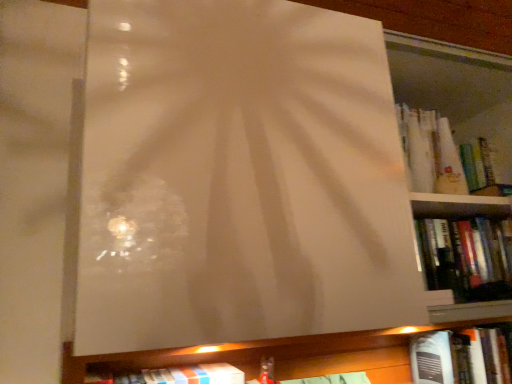
This screenshot has height=384, width=512. What do you see at coordinates (445, 157) in the screenshot? I see `hardcover book at upper right, marked as the 1th book in a top-to-bottom arrangement` at bounding box center [445, 157].

Find the location of a particular element. Image resolution: width=512 pixels, height=384 pixels. hardcover book at upper right, acting as the 3th book starting from the left is located at coordinates (445, 157).

From a real-world perspective, which object stands above the other?

In real-world perspective, hardcover book at upper right, which is the 3th book in bottom-to-top order, is above.

From the image's perspective, between hardcover book at lower right, which is the fourth book in left-to-right order, and hardcover book at upper right, the 2th book in the left-to-right sequence, who is located below?

hardcover book at lower right, which is the fourth book in left-to-right order, appears lower in the image.

Is there a large distance between hardcover book at lower right, acting as the 1th book starting from the right, and white matte book at lower center, the 3th book from the top?

No, hardcover book at lower right, acting as the 1th book starting from the right, is not far away from white matte book at lower center, the 3th book from the top.

Between hardcover book at lower right, acting as the fourth book starting from the top, and white matte book at lower center, positioned as the 1th book in left-to-right order, which one is positioned behind?

hardcover book at lower right, acting as the fourth book starting from the top.

From the image's perspective, is hardcover book at lower right, which is the fourth book in left-to-right order, located beneath white matte book at lower center, the 3th book from the top?

Correct, hardcover book at lower right, which is the fourth book in left-to-right order, appears lower than white matte book at lower center, the 3th book from the top, in the image.

Is hardcover book at upper right, the 2th book in the left-to-right sequence, further to the viewer compared to white matte book at lower center, placed as the 4th book when sorted from right to left?

Yes, it is.

Is hardcover book at upper right, the 3th book viewed from the right, oriented towards white matte book at lower center, the 2th book positioned from the bottom?

No.

Can you confirm if hardcover book at upper right, the 3th book viewed from the right, is taller than white matte book at lower center, positioned as the 1th book in left-to-right order?

Correct, hardcover book at upper right, the 3th book viewed from the right, is much taller as white matte book at lower center, positioned as the 1th book in left-to-right order.

From the image's perspective, which is above, hardcover book at upper right, the 2th book in the left-to-right sequence, or white matte book at lower center, placed as the 4th book when sorted from right to left?

From the image's view, hardcover book at upper right, the 2th book in the left-to-right sequence, is above.

From a real-world perspective, relative to white matte book at lower center, positioned as the 1th book in left-to-right order, is hardcover book at upper right, which ranks as the second book in right-to-left order, vertically above or below?

hardcover book at upper right, which ranks as the second book in right-to-left order, is above white matte book at lower center, positioned as the 1th book in left-to-right order.

From the image's perspective, which one is positioned higher, hardcover book at upper right, marked as the 1th book in a top-to-bottom arrangement, or white matte book at lower center, positioned as the 1th book in left-to-right order?

hardcover book at upper right, marked as the 1th book in a top-to-bottom arrangement, is shown above in the image.

Between hardcover book at upper right, acting as the 3th book starting from the left, and white matte book at lower center, the 3th book from the top, which one appears on the right side from the viewer's perspective?

Positioned to the right is hardcover book at upper right, acting as the 3th book starting from the left.

Does hardcover book at upper right, which ranks as the second book in right-to-left order, have a larger size compared to white matte book at lower center, placed as the 4th book when sorted from right to left?

Incorrect, hardcover book at upper right, which ranks as the second book in right-to-left order, is not larger than white matte book at lower center, placed as the 4th book when sorted from right to left.

From the hardcover book at upper right, the 2th book in the left-to-right sequence, count 2nd books backward and point to it. Please provide its 2D coordinates.

[(460, 358)]

Does hardcover book at upper right, the 2th book in the left-to-right sequence, appear on the left side of hardcover book at lower right, acting as the fourth book starting from the top?

Yes.

Is there a large distance between hardcover book at upper right, the 2th book in the left-to-right sequence, and hardcover book at lower right, acting as the fourth book starting from the top?

They are positioned close to each other.

Is hardcover book at upper right, acting as the 3th book starting from the left, inside or outside of hardcover book at upper right, the 2th book in the left-to-right sequence?

hardcover book at upper right, acting as the 3th book starting from the left, cannot be found inside hardcover book at upper right, the 2th book in the left-to-right sequence.

Identify the location of book above the hardcover book at upper right, which appears as the second book when viewed from the top (from a real-world perspective). This screenshot has height=384, width=512. point(445,157).

Is hardcover book at upper right, acting as the 4th book starting from the bottom, aimed at hardcover book at upper right, which appears as the second book when viewed from the top?

No, hardcover book at upper right, acting as the 4th book starting from the bottom, is not facing towards hardcover book at upper right, which appears as the second book when viewed from the top.

In the scene shown: Considering the positions of objects hardcover book at upper right, acting as the 4th book starting from the bottom, and hardcover book at upper right, the 3th book viewed from the right, in the image provided, who is behind, hardcover book at upper right, acting as the 4th book starting from the bottom, or hardcover book at upper right, the 3th book viewed from the right,?

hardcover book at upper right, acting as the 4th book starting from the bottom, is further away from the camera.

The image size is (512, 384). I want to click on the 1st book above when counting from the hardcover book at lower right, which ranks as the first book in bottom-to-top order (from the image's perspective), so click(177, 376).

Does point (177, 375) come closer to viewer compared to point (465, 366)?

That is True.

Is white matte book at lower center, placed as the 4th book when sorted from right to left, shorter than hardcover book at lower right, acting as the 1th book starting from the right?

Yes, white matte book at lower center, placed as the 4th book when sorted from right to left, is shorter than hardcover book at lower right, acting as the 1th book starting from the right.

Consider the image. Based on their sizes in the image, would you say white matte book at lower center, placed as the 4th book when sorted from right to left, is bigger or smaller than hardcover book at lower right, which ranks as the first book in bottom-to-top order?

In the image, white matte book at lower center, placed as the 4th book when sorted from right to left, appears to be smaller than hardcover book at lower right, which ranks as the first book in bottom-to-top order.

Identify the location of book that is the 2nd one when counting upward from the hardcover book at lower right, acting as the fourth book starting from the top (from the image's perspective). (467, 257).

Starting from the white matte book at lower center, positioned as the 1th book in left-to-right order, which book is the 3rd one behind? Please provide its 2D coordinates.

[(460, 358)]

Looking at the image, which one is located further to white matte book at lower center, placed as the 4th book when sorted from right to left, hardcover book at upper right, which ranks as the second book in right-to-left order, or hardcover book at lower right, acting as the fourth book starting from the top?

The object further to white matte book at lower center, placed as the 4th book when sorted from right to left, is hardcover book at upper right, which ranks as the second book in right-to-left order.

Looking at the image, which one is located closer to hardcover book at lower right, which is the fourth book in left-to-right order, hardcover book at upper right, which appears as the second book when viewed from the top, or hardcover book at upper right, marked as the 1th book in a top-to-bottom arrangement?

hardcover book at upper right, which appears as the second book when viewed from the top, is positioned closer to the anchor hardcover book at lower right, which is the fourth book in left-to-right order.

When comparing their distances from hardcover book at upper right, the 3th book viewed from the right, does hardcover book at upper right, marked as the 1th book in a top-to-bottom arrangement, or white matte book at lower center, the 3th book from the top, seem closer?

hardcover book at upper right, marked as the 1th book in a top-to-bottom arrangement, is positioned closer to the anchor hardcover book at upper right, the 3th book viewed from the right.

Considering their positions, is hardcover book at lower right, which is the fourth book in left-to-right order, positioned further to hardcover book at upper right, the 3th book viewed from the right, than hardcover book at upper right, acting as the 3th book starting from the left?

hardcover book at lower right, which is the fourth book in left-to-right order, is further to hardcover book at upper right, the 3th book viewed from the right.

Looking at the image, which one is located further to hardcover book at upper right, acting as the 4th book starting from the bottom, hardcover book at upper right, which appears as the second book when viewed from the top, or hardcover book at lower right, which ranks as the first book in bottom-to-top order?

hardcover book at lower right, which ranks as the first book in bottom-to-top order, is further to hardcover book at upper right, acting as the 4th book starting from the bottom.

From the image, which object appears to be nearer to hardcover book at lower right, which is the fourth book in left-to-right order, hardcover book at upper right, acting as the 3th book starting from the left, or white matte book at lower center, placed as the 4th book when sorted from right to left?

hardcover book at upper right, acting as the 3th book starting from the left, lies closer to hardcover book at lower right, which is the fourth book in left-to-right order, than the other object.

Considering their positions, is white matte book at lower center, positioned as the 1th book in left-to-right order, positioned closer to hardcover book at upper right, which is the 3th book in bottom-to-top order, than hardcover book at lower right, which ranks as the first book in bottom-to-top order?

hardcover book at lower right, which ranks as the first book in bottom-to-top order.

Based on their spatial positions, is hardcover book at upper right, marked as the 1th book in a top-to-bottom arrangement, or hardcover book at upper right, the 3th book viewed from the right, closer to hardcover book at lower right, which is the fourth book in left-to-right order?

Based on the image, hardcover book at upper right, the 3th book viewed from the right, appears to be nearer to hardcover book at lower right, which is the fourth book in left-to-right order.

Identify the location of book between white matte book at lower center, the 3th book from the top, and hardcover book at upper right, marked as the 1th book in a top-to-bottom arrangement. tap(467, 257).